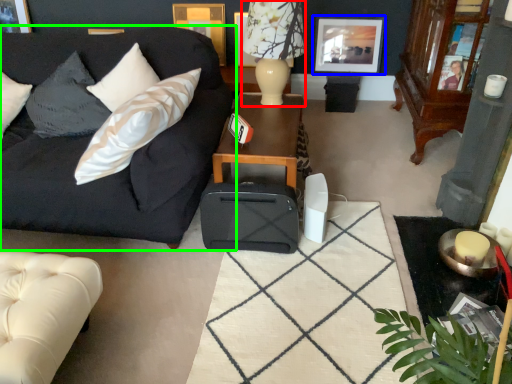
Question: Considering the real-world distances, which object is farthest from lamp (highlighted by a red box)? picture frame (highlighted by a blue box) or studio couch (highlighted by a green box)?

Choices:
 (A) picture frame
 (B) studio couch

Answer: (A)